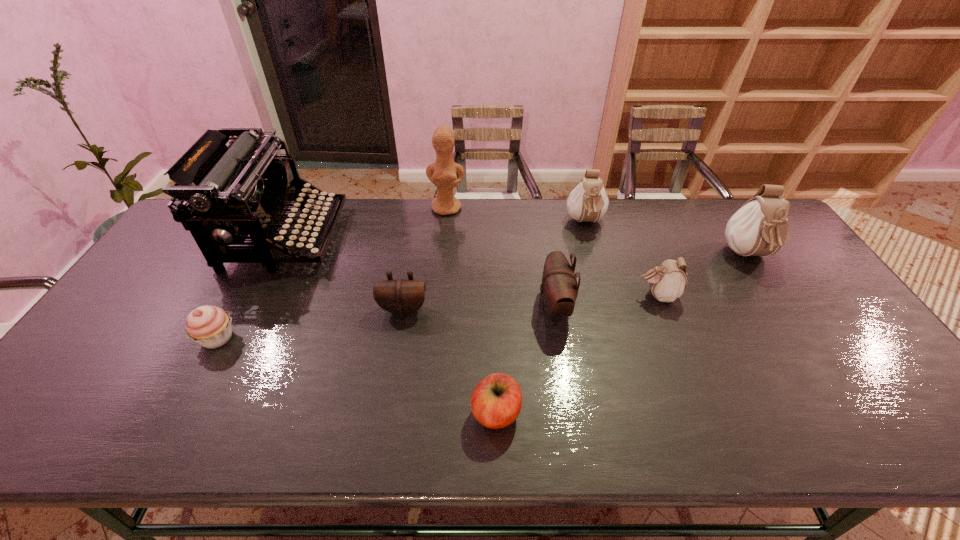
What are the coordinates of `object that is at the near edge` in the screenshot? It's located at (496, 401).

Find the location of a particular element. The image size is (960, 540). object present at the right edge is located at coordinates (759, 228).

The width and height of the screenshot is (960, 540). Find the location of `object present at the far right corner`. object present at the far right corner is located at coordinates (759, 228).

Where is `free space at the far edge of the desktop`? This screenshot has height=540, width=960. free space at the far edge of the desktop is located at coordinates (612, 215).

The width and height of the screenshot is (960, 540). In the image, there is a desktop. Identify the location of vacant space at the near edge. (845, 425).

In the image, there is a desktop. Where is `blank space at the right edge`? The width and height of the screenshot is (960, 540). blank space at the right edge is located at coordinates (846, 356).

You are a GUI agent. You are given a task and a screenshot of the screen. Output one action in this format:
    pyautogui.click(x=<x>, y=<y>)
    Task: Click on the vacant region at the near left corner of the desktop
    The width and height of the screenshot is (960, 540).
    Given the screenshot: What is the action you would take?
    pyautogui.click(x=65, y=435)

Find the location of `free space between the figurine and the nearest object`. free space between the figurine and the nearest object is located at coordinates (471, 310).

You are a GUI agent. You are given a task and a screenshot of the screen. Output one action in this format:
    pyautogui.click(x=<x>, y=<y>)
    Task: Click on the empty space that is in between the apple and the rightmost object
    This screenshot has width=960, height=540.
    Given the screenshot: What is the action you would take?
    pyautogui.click(x=622, y=334)

The width and height of the screenshot is (960, 540). I want to click on vacant region between the nearest object and the nearest white pouch, so click(577, 354).